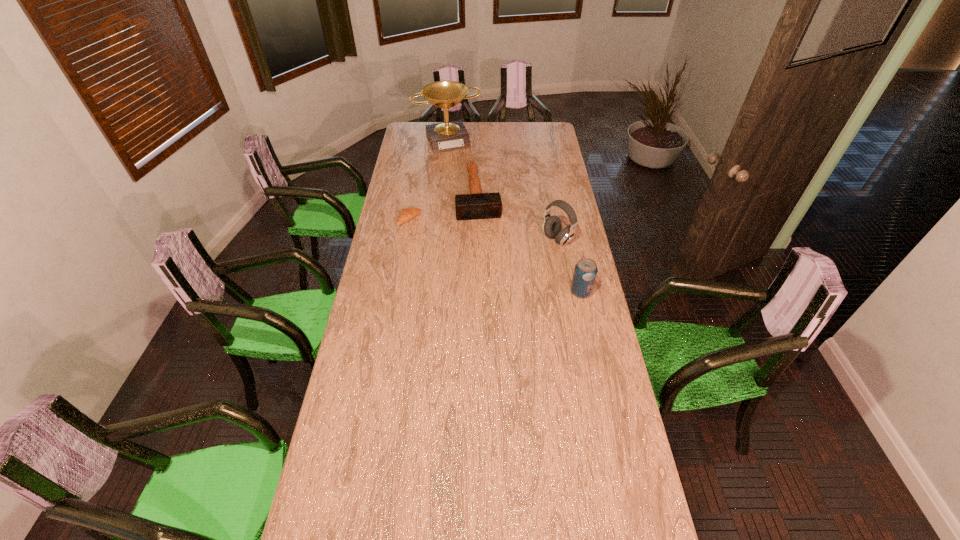
Locate an element on the screen. The image size is (960, 540). vacant space that's between the fourth shortest object and the crescent roll is located at coordinates (484, 229).

Where is `empty space that is in between the headset and the crescent roll`? Image resolution: width=960 pixels, height=540 pixels. empty space that is in between the headset and the crescent roll is located at coordinates (484, 229).

Identify the location of vacant space that is in between the third shortest object and the headset. (569, 266).

Locate an element on the screen. This screenshot has height=540, width=960. vacant space that's between the nearest object and the mallet is located at coordinates (530, 244).

Locate an element on the screen. vacant point located between the second tallest object and the shortest object is located at coordinates (484, 229).

Where is `vacant area that lies between the second tallest object and the mallet`? vacant area that lies between the second tallest object and the mallet is located at coordinates (517, 217).

Where is `vacant area that lies between the tallest object and the crescent roll`? This screenshot has width=960, height=540. vacant area that lies between the tallest object and the crescent roll is located at coordinates (429, 180).

Image resolution: width=960 pixels, height=540 pixels. Identify the location of vacant area that lies between the nearest object and the fourth shortest object. (569, 266).

The width and height of the screenshot is (960, 540). What are the coordinates of `object that stands as the third closest to the nearest object` in the screenshot? It's located at (407, 214).

This screenshot has height=540, width=960. Identify the location of object that is the third nearest to the third shortest object. (407, 214).